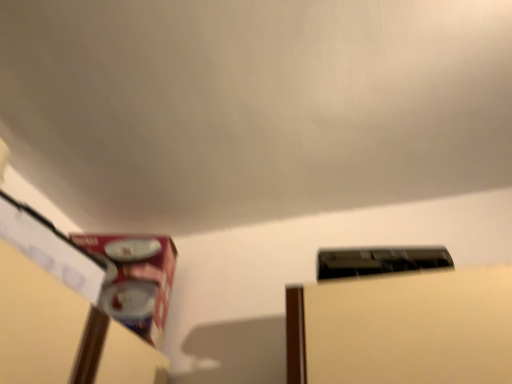
Question: Would you say metallic silver water heater at lower left, which ranks as the 2th water heater in right-to-left order, is inside or outside black glossy water heater at upper right, which is the 1th water heater from front to back?

Choices:
 (A) inside
 (B) outside

Answer: (B)

Question: In terms of height, does metallic silver water heater at lower left, the first water heater from the left, look taller or shorter compared to black glossy water heater at upper right, which is the 1th water heater from front to back?

Choices:
 (A) short
 (B) tall

Answer: (B)

Question: Does point (117, 309) appear closer or farther from the camera than point (445, 266)?

Choices:
 (A) farther
 (B) closer

Answer: (A)

Question: From a real-world perspective, relative to metallic silver water heater at lower left, which ranks as the 2th water heater in right-to-left order, is black glossy water heater at upper right, the second water heater positioned from the back, vertically above or below?

Choices:
 (A) below
 (B) above

Answer: (A)

Question: Is black glossy water heater at upper right, which is the 1th water heater from front to back, situated inside metallic silver water heater at lower left, which is counted as the first water heater, starting from the back, or outside?

Choices:
 (A) outside
 (B) inside

Answer: (A)

Question: In terms of width, does black glossy water heater at upper right, the second water heater positioned from the back, look wider or thinner when compared to metallic silver water heater at lower left, which is counted as the first water heater, starting from the back?

Choices:
 (A) wide
 (B) thin

Answer: (B)

Question: Is black glossy water heater at upper right, arranged as the first water heater when viewed from the right, to the left or to the right of metallic silver water heater at lower left, the first water heater from the left, in the image?

Choices:
 (A) right
 (B) left

Answer: (A)